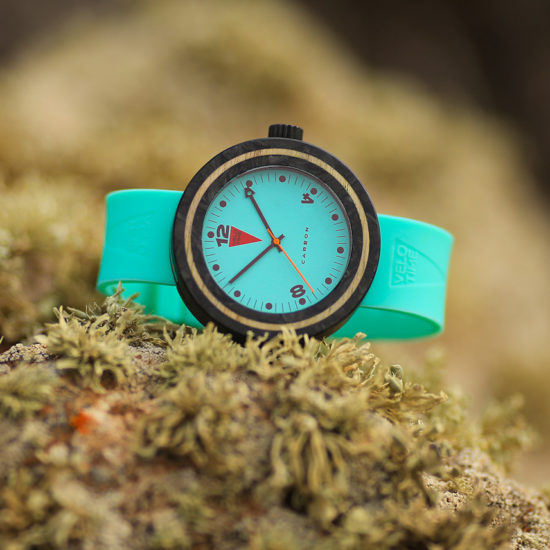
Where is `1 knob`? The width and height of the screenshot is (550, 550). 1 knob is located at coordinates (289, 129).